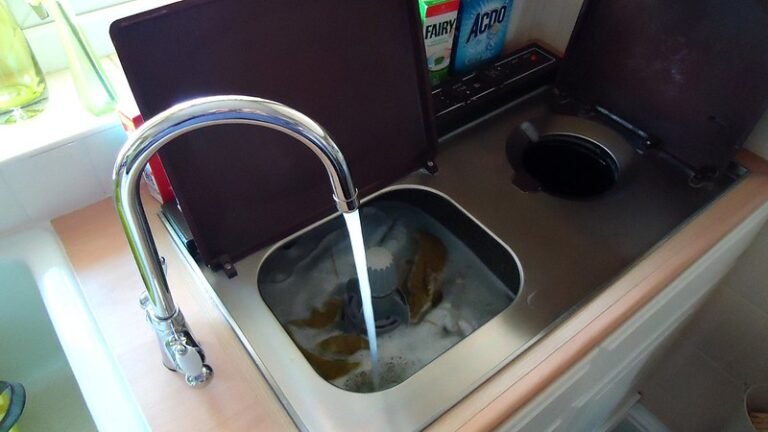
I want to click on handles, so (196, 366), (147, 303).